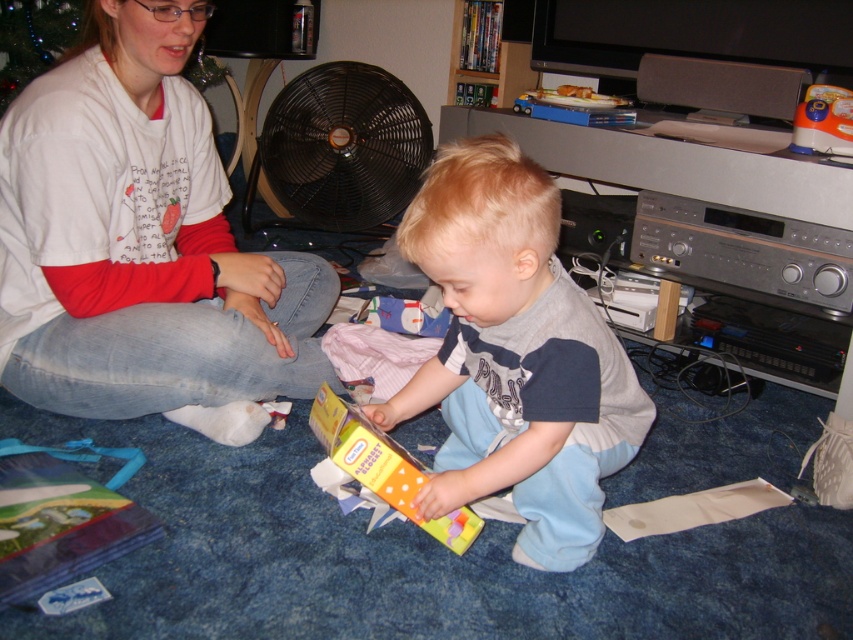
Question: Does white cotton shirt at upper left lie in front of orange plastic toy at upper right?

Choices:
 (A) no
 (B) yes

Answer: (B)

Question: Is orange polka dot book at center positioned before black plastic fan at upper center?

Choices:
 (A) yes
 (B) no

Answer: (A)

Question: Does white cotton shirt at upper left appear on the left side of black plastic fan at upper center?

Choices:
 (A) no
 (B) yes

Answer: (B)

Question: Which object is the closest to the yellow paper at center?

Choices:
 (A) white cotton shirt at upper left
 (B) orange polka dot book at center

Answer: (B)

Question: Which point appears farthest from the camera in this image?

Choices:
 (A) (287, 209)
 (B) (459, 195)
 (C) (62, 166)

Answer: (A)

Question: Among these points, which one is farthest from the camera?

Choices:
 (A) (576, 557)
 (B) (392, 490)
 (C) (335, 173)
 (D) (810, 86)

Answer: (C)